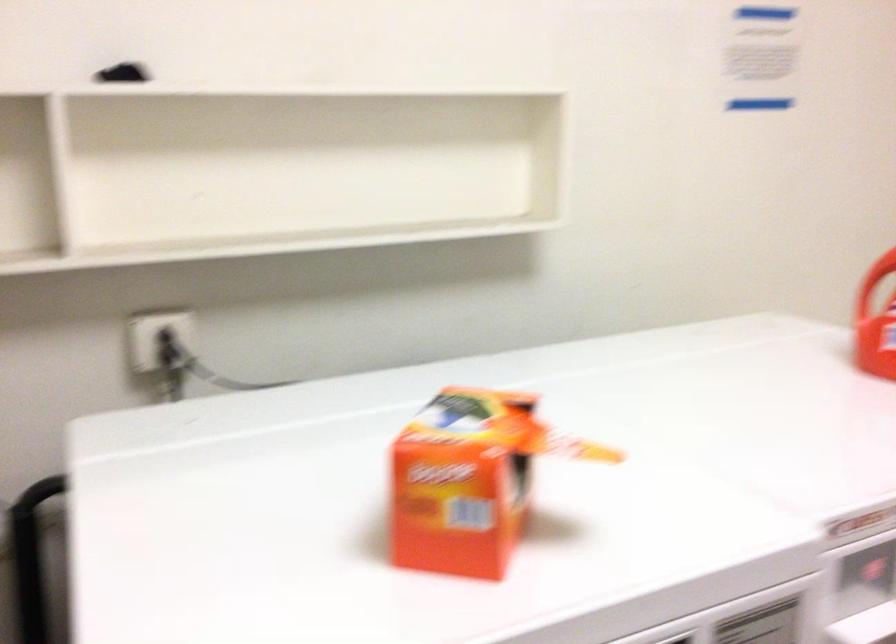
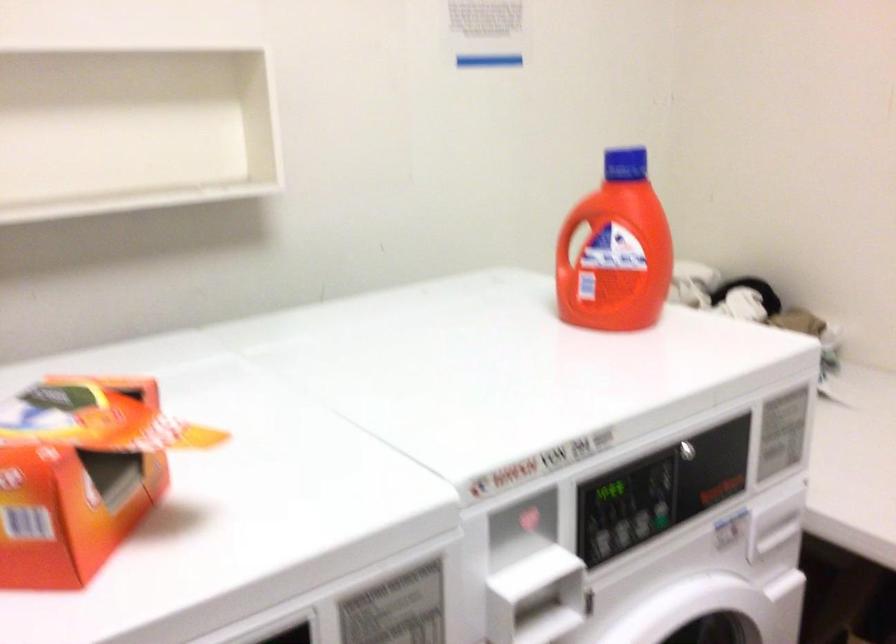
Locate, in the second image, the point that corresponds to [501,506] in the first image.

(73, 498)